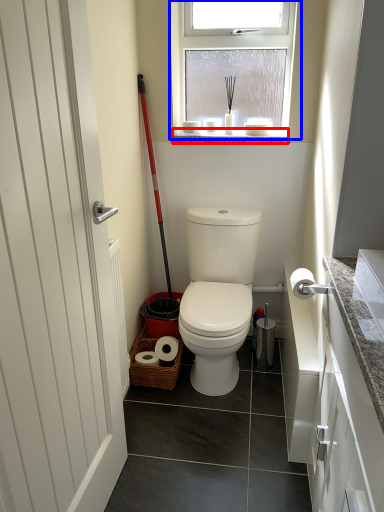
Question: Which point is closer to the camera, window sill (highlighted by a red box) or window (highlighted by a blue box)?

Choices:
 (A) window sill
 (B) window

Answer: (B)